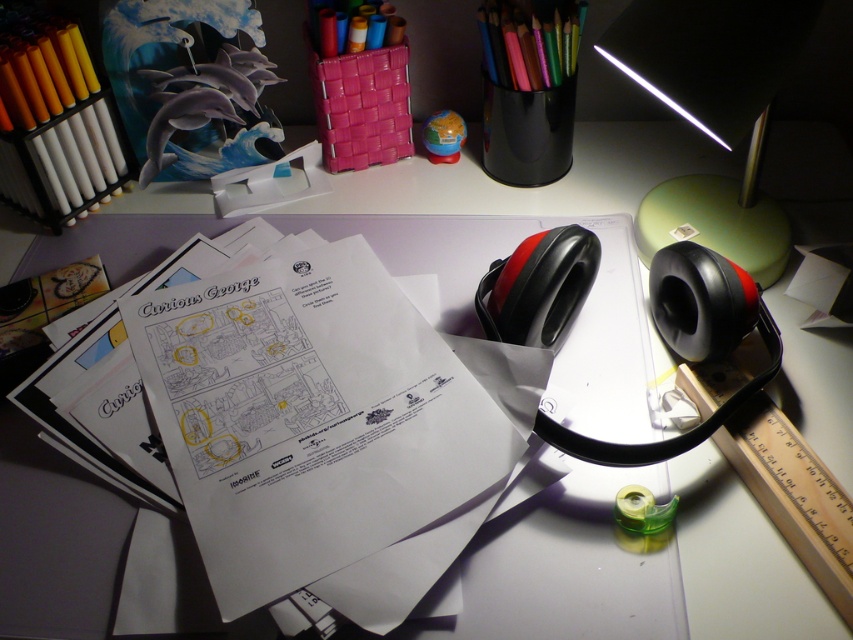
Question: Which point is closer to the camera?

Choices:
 (A) (430, 115)
 (B) (376, 516)
 (C) (317, 12)
 (D) (22, 122)

Answer: (B)

Question: Which of the following is the farthest from the observer?

Choices:
 (A) white paper at center
 (B) matte yellow pencil at upper left
 (C) green matte lamp at upper right

Answer: (B)

Question: Is green matte lamp at upper right closer to the viewer compared to colored pencils at upper right?

Choices:
 (A) yes
 (B) no

Answer: (A)

Question: Where is multicolored pencils at upper center located in relation to matte plastic globe at center in the image?

Choices:
 (A) above
 (B) below

Answer: (A)

Question: Is white paper at center positioned behind matte plastic markers at upper center?

Choices:
 (A) no
 (B) yes

Answer: (A)

Question: Which point appears closest to the camera in this image?

Choices:
 (A) (373, 564)
 (B) (9, 120)
 (C) (538, 24)

Answer: (A)